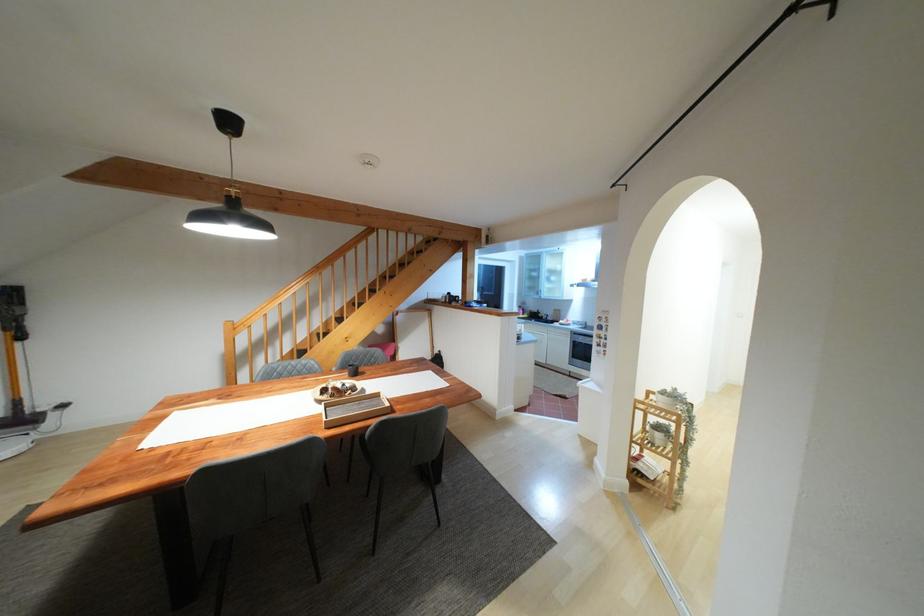
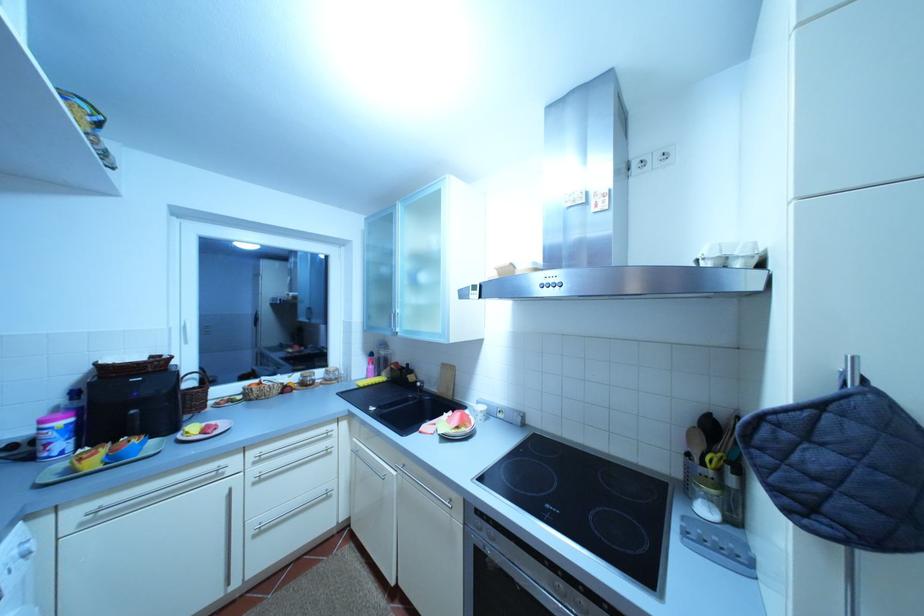
The images are taken continuously from a first-person perspective. In which direction are you moving?

The cameraman moved toward right, forward.